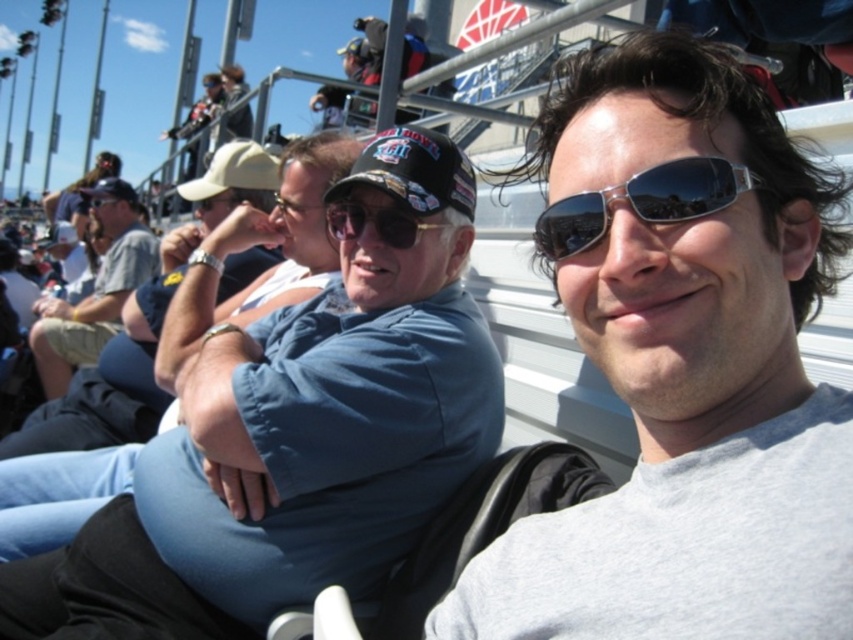
Who is positioned more to the left, light blue shirt at center or silver reflective sunglasses at center?

light blue shirt at center is more to the left.

This screenshot has width=853, height=640. What do you see at coordinates (94, 292) in the screenshot?
I see `light blue shirt at center` at bounding box center [94, 292].

Which is in front, point (90, 193) or point (602, 216)?

Point (602, 216) is more forward.

You are a GUI agent. You are given a task and a screenshot of the screen. Output one action in this format:
    pyautogui.click(x=<x>, y=<y>)
    Task: Click on the light blue shirt at center
    
    Given the screenshot: What is the action you would take?
    pyautogui.click(x=94, y=292)

Is blue fabric shirt at center below matte black sunglasses at center?

Correct, blue fabric shirt at center is located below matte black sunglasses at center.

The width and height of the screenshot is (853, 640). Describe the element at coordinates (296, 436) in the screenshot. I see `blue fabric shirt at center` at that location.

You are a GUI agent. You are given a task and a screenshot of the screen. Output one action in this format:
    pyautogui.click(x=<x>, y=<y>)
    Task: Click on the blue fabric shirt at center
    The image size is (853, 640).
    Given the screenshot: What is the action you would take?
    pyautogui.click(x=296, y=436)

You are a GUI agent. You are given a task and a screenshot of the screen. Output one action in this format:
    pyautogui.click(x=<x>, y=<y>)
    Task: Click on the gray matte shirt at center
    The height and width of the screenshot is (640, 853).
    Given the screenshot: What is the action you would take?
    pyautogui.click(x=683, y=369)

Is gray matte shirt at center smaller than light blue shirt at center?

Yes.

Does point (631, 208) come farther from viewer compared to point (79, 317)?

No, (631, 208) is closer to viewer.

This screenshot has height=640, width=853. Identify the location of gray matte shirt at center. (683, 369).